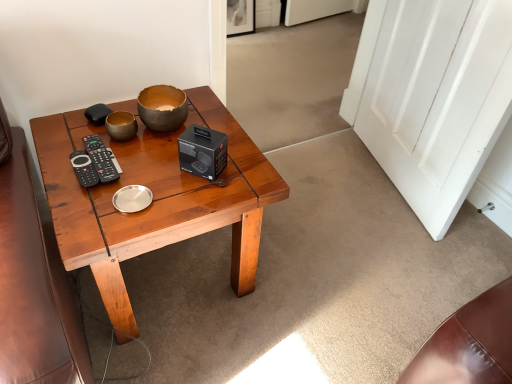
Find the location of a particular element. The image size is (512, 384). vacant space to the left of black plastic remote at left is located at coordinates (55, 153).